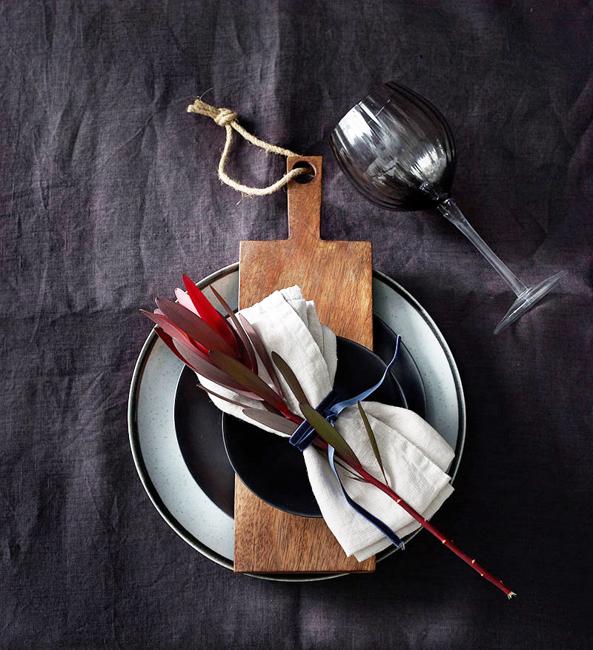
Find the location of a particular element. The width and height of the screenshot is (593, 650). glass is located at coordinates (400, 131).